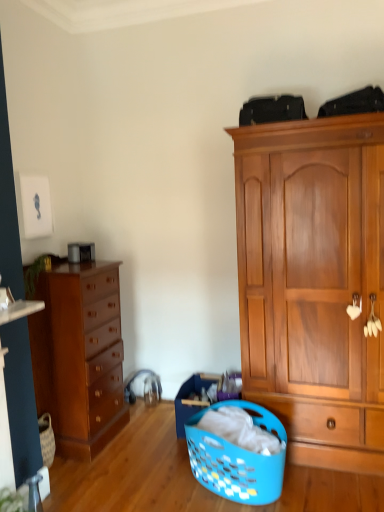
The width and height of the screenshot is (384, 512). What do you see at coordinates (237, 459) in the screenshot?
I see `blue plastic laundry basket at lower center` at bounding box center [237, 459].

Where is `shiny brown dresser at left`? shiny brown dresser at left is located at coordinates (79, 356).

Considering the relative sizes of wooden cabinet at right and shiny brown dresser at left in the image provided, is wooden cabinet at right wider than shiny brown dresser at left?

Yes.

Which is closer, (279, 123) or (62, 400)?

The point (279, 123) is in front.

Are wooden cabinet at right and shiny brown dresser at left making contact?

wooden cabinet at right and shiny brown dresser at left are not in contact.

Is wooden cabinet at right to the right of shiny brown dresser at left from the viewer's perspective?

Yes.

Is blue plastic laundry basket at lower center aimed at shiny brown dresser at left?

No, blue plastic laundry basket at lower center is not turned towards shiny brown dresser at left.

Is blue plastic laundry basket at lower center to the right of shiny brown dresser at left from the viewer's perspective?

Correct, you'll find blue plastic laundry basket at lower center to the right of shiny brown dresser at left.

Is point (253, 423) farther from camera compared to point (84, 330)?

No, (253, 423) is closer to viewer.

Is blue plastic laundry basket at lower center taller or shorter than shiny brown dresser at left?

blue plastic laundry basket at lower center is shorter than shiny brown dresser at left.

Are shiny brown dresser at left and wooden cabinet at right far apart?

That's right, there is a large distance between shiny brown dresser at left and wooden cabinet at right.

Is shiny brown dresser at left oriented away from wooden cabinet at right?

No, shiny brown dresser at left is not facing the opposite direction of wooden cabinet at right.

In the image, is shiny brown dresser at left on the left side or the right side of wooden cabinet at right?

Based on their positions, shiny brown dresser at left is located to the left of wooden cabinet at right.

Considering the relative positions of shiny brown dresser at left and wooden cabinet at right in the image provided, is shiny brown dresser at left in front of wooden cabinet at right?

That is False.

Would you consider blue plastic laundry basket at lower center to be distant from wooden cabinet at right?

No, blue plastic laundry basket at lower center is not far away from wooden cabinet at right.

Is blue plastic laundry basket at lower center taller or shorter than wooden cabinet at right?

Considering their sizes, blue plastic laundry basket at lower center has less height than wooden cabinet at right.

Could you tell me if blue plastic laundry basket at lower center is turned towards wooden cabinet at right?

No, blue plastic laundry basket at lower center is not facing towards wooden cabinet at right.

How different are the orientations of blue plastic laundry basket at lower center and wooden cabinet at right in degrees?

49.8 degrees separate the facing orientations of blue plastic laundry basket at lower center and wooden cabinet at right.

Which object is closer to the camera, shiny brown dresser at left or blue plastic laundry basket at lower center?

blue plastic laundry basket at lower center is closer to the camera.

From a real-world perspective, is shiny brown dresser at left positioned under blue plastic laundry basket at lower center based on gravity?

No, from a real-world perspective, shiny brown dresser at left is not beneath blue plastic laundry basket at lower center.

Which of these two, shiny brown dresser at left or blue plastic laundry basket at lower center, is thinner?

shiny brown dresser at left is thinner.

From the image's perspective, between shiny brown dresser at left and blue plastic laundry basket at lower center, which one is located above?

shiny brown dresser at left, from the image's perspective.

Between wooden cabinet at right and blue plastic laundry basket at lower center, which one has smaller size?

blue plastic laundry basket at lower center is smaller.

Is wooden cabinet at right shorter than blue plastic laundry basket at lower center?

No, wooden cabinet at right is not shorter than blue plastic laundry basket at lower center.

Is blue plastic laundry basket at lower center a part of wooden cabinet at right?

No, blue plastic laundry basket at lower center is not inside wooden cabinet at right.

Are wooden cabinet at right and blue plastic laundry basket at lower center far apart?

No, wooden cabinet at right is in close proximity to blue plastic laundry basket at lower center.

Locate an element on the screen. cabinetry above the shiny brown dresser at left (from the image's perspective) is located at coordinates (x=313, y=283).

Find the location of a particular element. Image resolution: width=384 pixels, height=512 pixels. chest of drawers lying on the left of blue plastic laundry basket at lower center is located at coordinates (79, 356).

Considering their positions, is shiny brown dresser at left positioned closer to wooden cabinet at right than blue plastic laundry basket at lower center?

blue plastic laundry basket at lower center lies closer to wooden cabinet at right than the other object.

When comparing their distances from wooden cabinet at right, does blue plastic laundry basket at lower center or shiny brown dresser at left seem closer?

Among the two, blue plastic laundry basket at lower center is located nearer to wooden cabinet at right.

When comparing their distances from blue plastic laundry basket at lower center, does wooden cabinet at right or shiny brown dresser at left seem closer?

wooden cabinet at right.

Considering their positions, is wooden cabinet at right positioned further to shiny brown dresser at left than blue plastic laundry basket at lower center?

The object further to shiny brown dresser at left is wooden cabinet at right.

Estimate the real-world distances between objects in this image. Which object is further from blue plastic laundry basket at lower center, shiny brown dresser at left or wooden cabinet at right?

shiny brown dresser at left.

From the image, which object appears to be nearer to shiny brown dresser at left, blue plastic laundry basket at lower center or wooden cabinet at right?

blue plastic laundry basket at lower center.

Find the location of a particular element. picnic basket between shiny brown dresser at left and wooden cabinet at right from left to right is located at coordinates (237, 459).